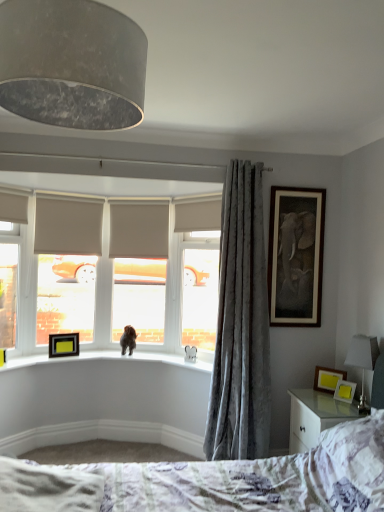
Find the location of a particular element. This screenshot has width=384, height=512. vacant area that is situated to the right of matte yellow picture frame at lower right, which appears as the first picture frame when viewed from the right is located at coordinates (360, 401).